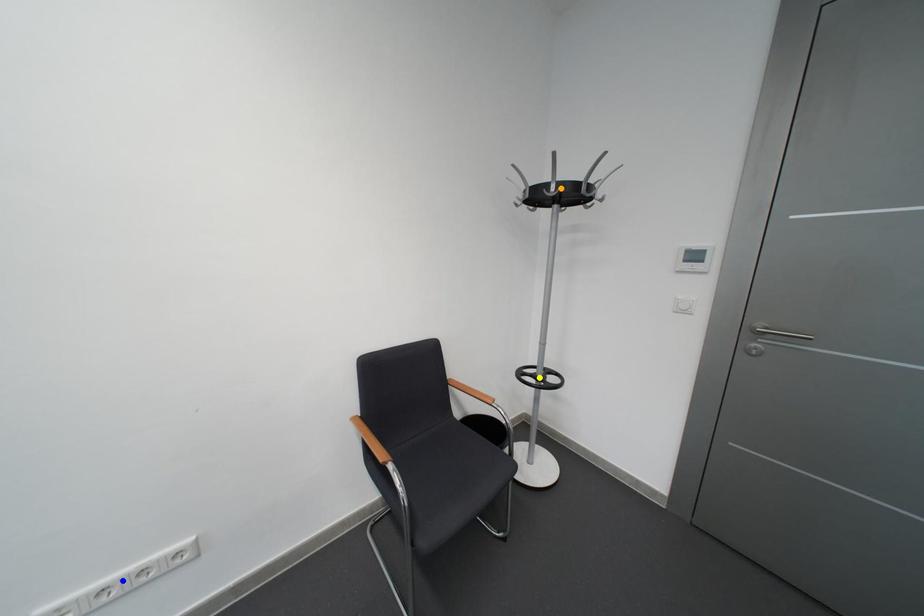
Order these from nearest to farthest:
yellow point
orange point
blue point

blue point → orange point → yellow point